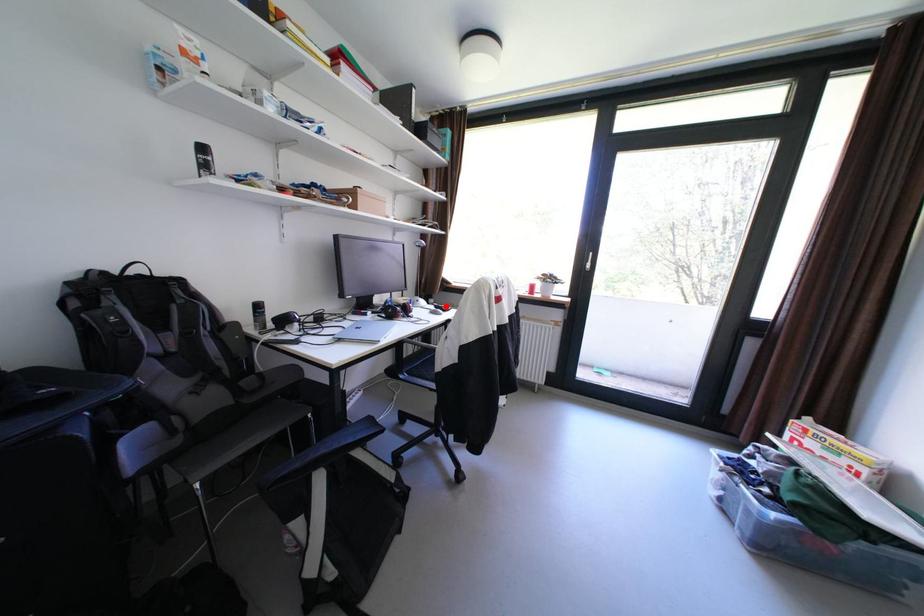
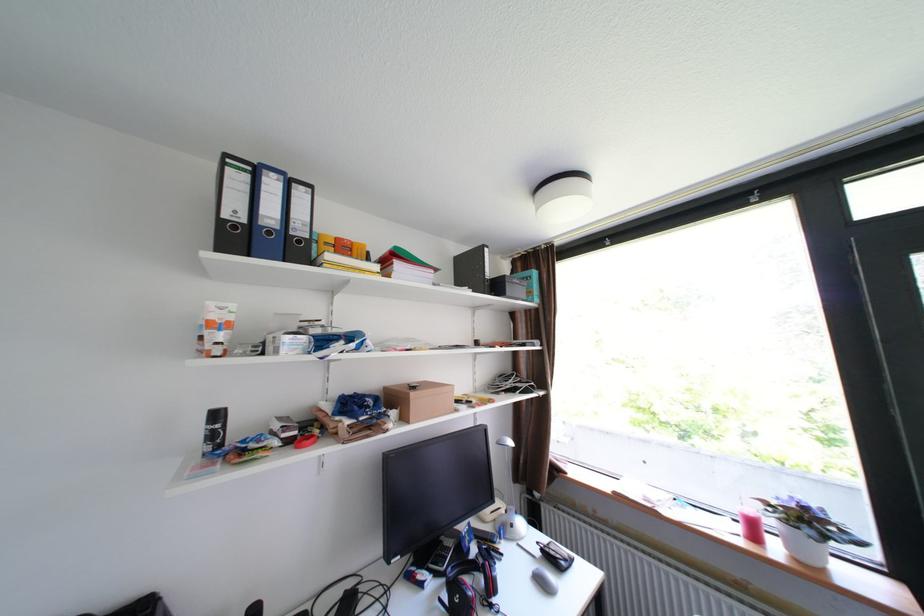
Find the pixel in the second image that matches the highlighted location in the first image.

(553, 551)